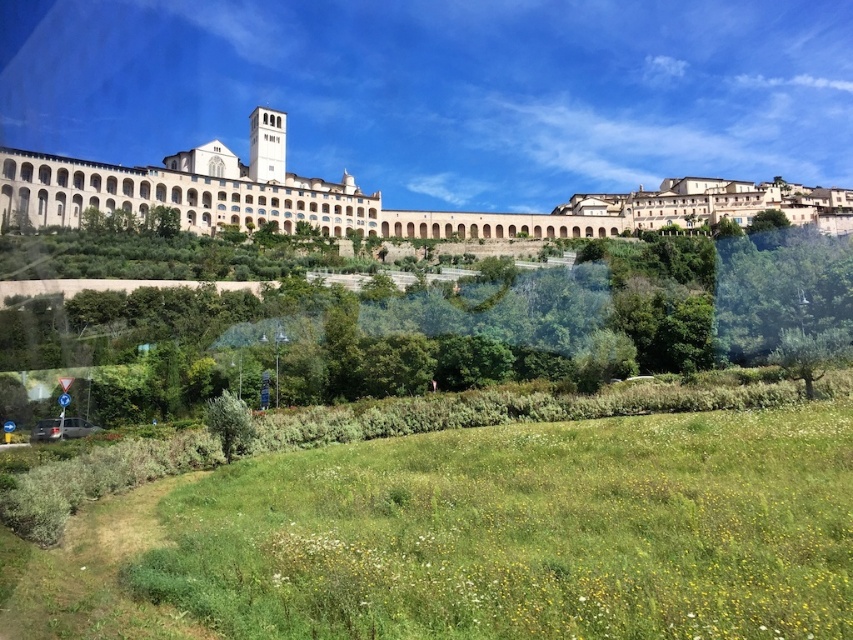
Question: Among these points, which one is farthest from the camera?

Choices:
 (A) (312, 392)
 (B) (341, 500)

Answer: (A)

Question: Does green leafy tree at center have a larger size compared to white stone building at upper center?

Choices:
 (A) yes
 (B) no

Answer: (B)

Question: Is green grassy field at lower center positioned before green leafy tree at center?

Choices:
 (A) no
 (B) yes

Answer: (B)

Question: Observing the image, what is the correct spatial positioning of green leafy tree at center in reference to white stone building at upper center?

Choices:
 (A) left
 (B) right

Answer: (A)

Question: Which of these objects is positioned farthest from the green grassy field at lower center?

Choices:
 (A) white stone building at upper center
 (B) green leafy tree at center

Answer: (A)

Question: Which point is closer to the camera?

Choices:
 (A) green grassy field at lower center
 (B) white stone building at upper center
 (C) green leafy tree at center

Answer: (A)